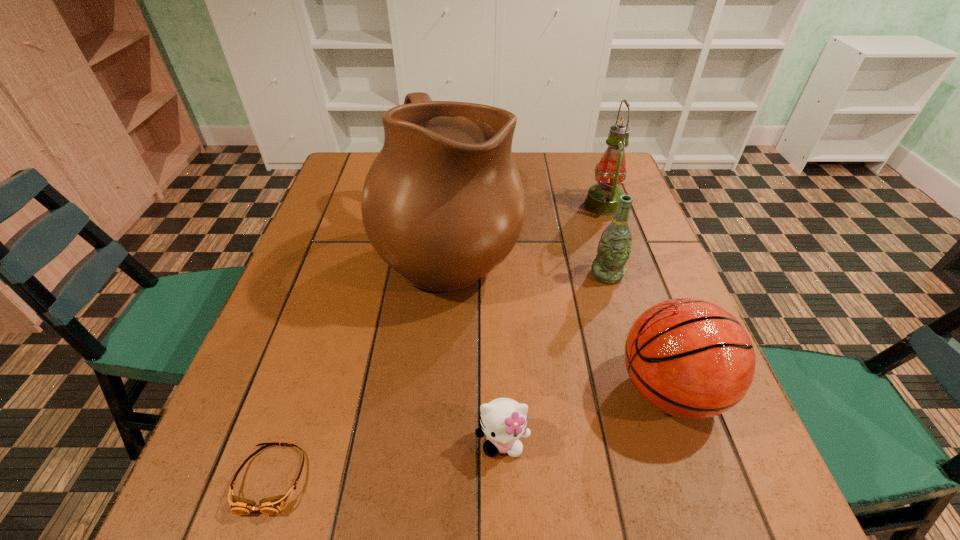
Find the location of a particular element. This screenshot has width=960, height=540. cream pitcher is located at coordinates (443, 204).

Where is `oil lamp`? oil lamp is located at coordinates (602, 198).

Where is `beer bottle`? beer bottle is located at coordinates (614, 248).

The height and width of the screenshot is (540, 960). Find the location of `basketball`. basketball is located at coordinates (689, 358).

Identify the location of the fifth tallest object. This screenshot has width=960, height=540. (503, 421).

The width and height of the screenshot is (960, 540). I want to click on the leftmost object, so click(273, 505).

Where is `goggles`? goggles is located at coordinates pyautogui.click(x=273, y=505).

You are a GUI agent. You are given a task and a screenshot of the screen. Output one action in this format:
    pyautogui.click(x=<x>, y=<y>)
    Task: Click on the blank space located at the spout of the cream pitcher
    This screenshot has height=540, width=960.
    Given the screenshot: What is the action you would take?
    pyautogui.click(x=606, y=249)

At what (x,y) coordinates should I click in order to perform the action: click on vacant space located on the back of the oil lamp. Please return your answer as a coordinate pair (x, y). Looking at the image, I should click on (589, 166).

The height and width of the screenshot is (540, 960). I want to click on free region located on the surface of the beer bottle, so click(660, 455).